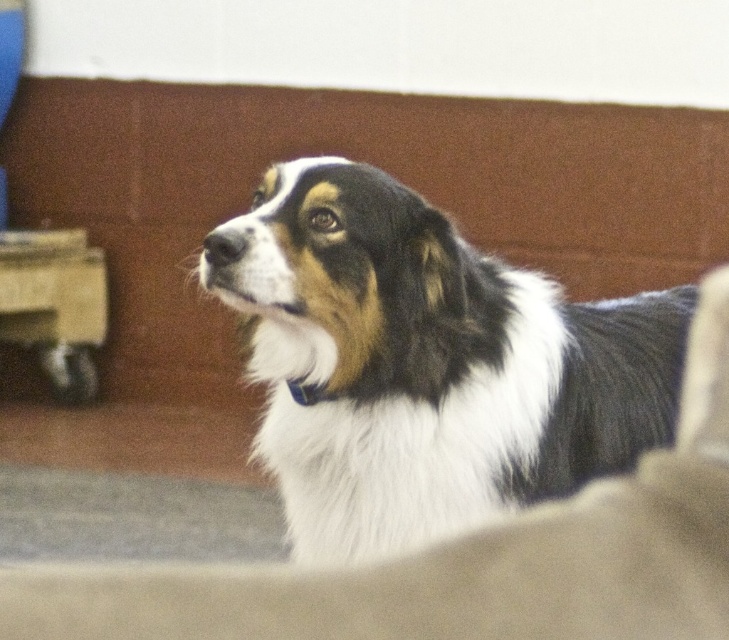
Question: Among these objects, which one is nearest to the camera?

Choices:
 (A) beige fabric dog bed at center
 (B) white-furred dog at center

Answer: (B)

Question: Is white-furred dog at center further to camera compared to beige fabric dog bed at center?

Choices:
 (A) yes
 (B) no

Answer: (B)

Question: Which point is closer to the camera?

Choices:
 (A) (130, 582)
 (B) (386, 317)

Answer: (A)

Question: Does white-furred dog at center appear on the left side of beige fabric dog bed at center?

Choices:
 (A) no
 (B) yes

Answer: (B)

Question: Observing the image, what is the correct spatial positioning of white-furred dog at center in reference to beige fabric dog bed at center?

Choices:
 (A) right
 (B) left

Answer: (B)